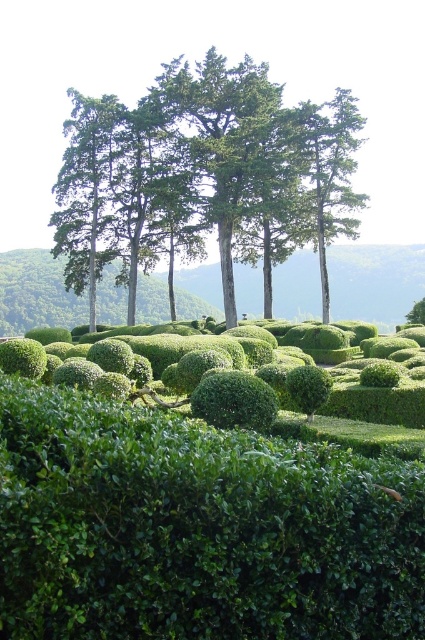
You are a landscape architect planning to add a new pathway between the green leafy trees at upper center and the green leafy tree at center. Considering their sizes, which tree will require more space to accommodate its width?

The green leafy trees at upper center will require more space because its width is larger than the green leafy tree at center.

You are standing in the garden and notice two green leafy trees. The first is labeled as green leafy trees at upper center and the second as green leafy tree at center. Which of these two trees is positioned to the left of the other?

The green leafy trees at upper center is positioned to the left of the green leafy tree at center.

You are a gardener planning to prune the green leafy trees at upper center and the green leafy tree at center. Based on their positions, which tree should you tackle first to avoid obstructing your view of the other?

You should prune the green leafy tree at center first because the green leafy trees at upper center is positioned under it, so pruning the upper one first might make it harder to see the lower tree afterward.